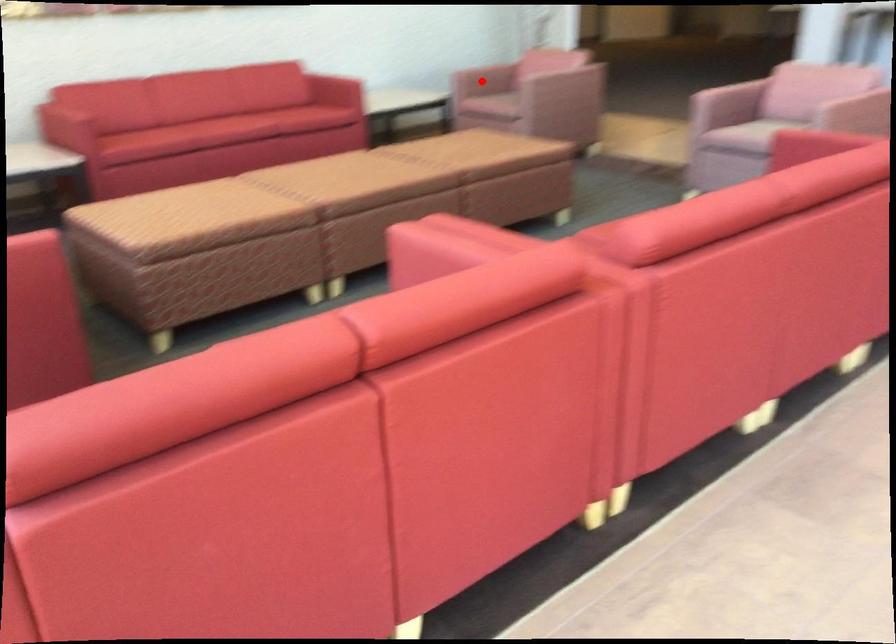
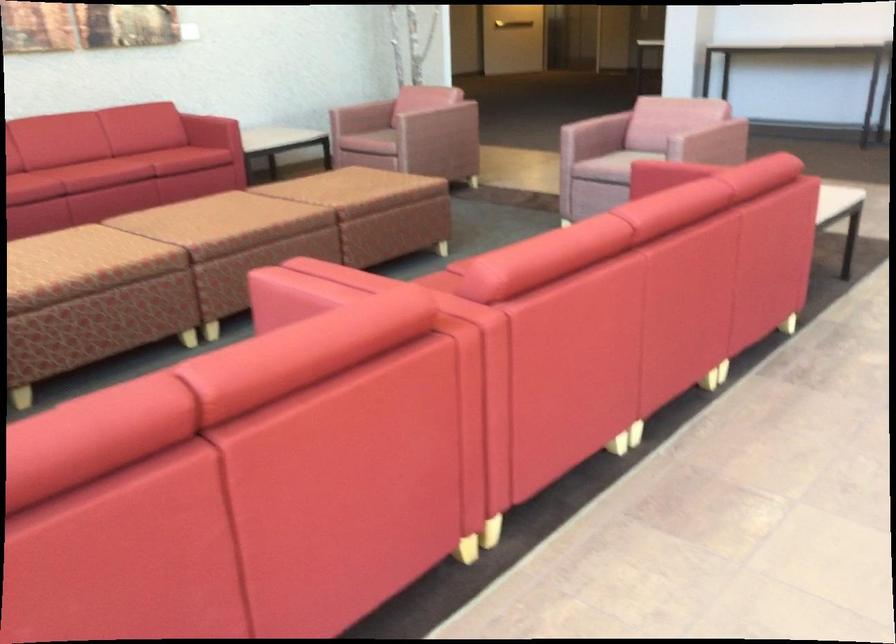
Locate, in the second image, the point that corresponds to the highlighted location in the first image.

(362, 117)